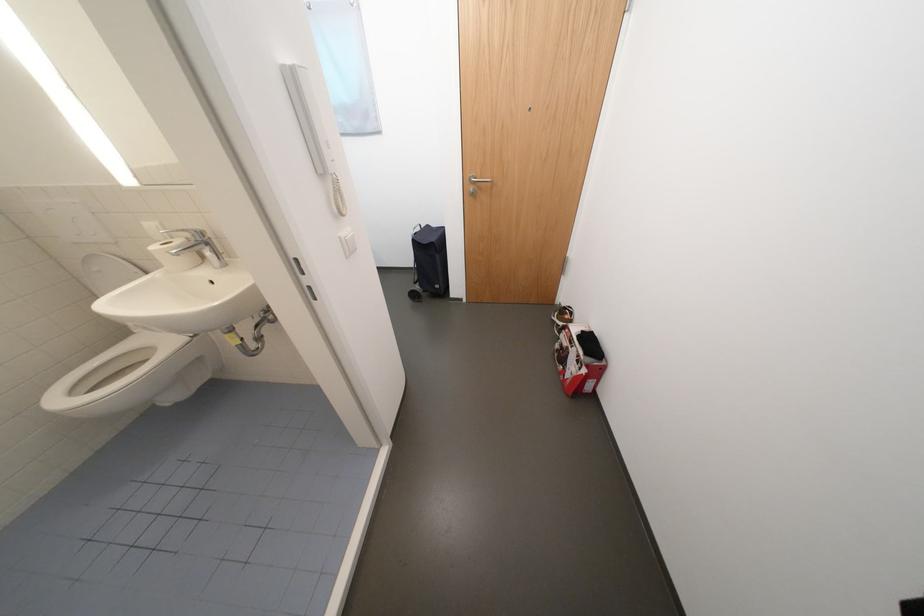
Which object does [175,254] point to?

This point indicates the toilet paper roll.